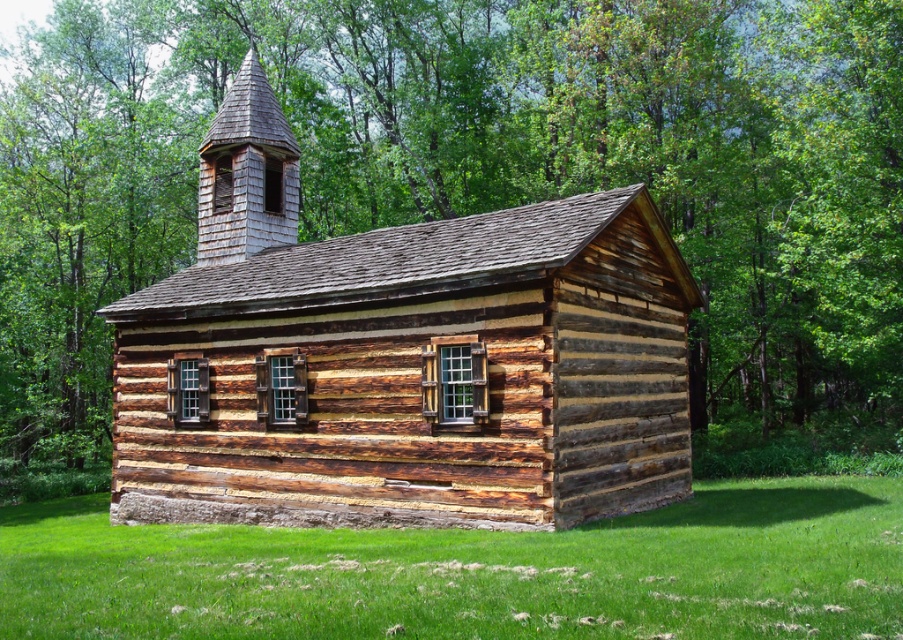
You are standing on the green grass at lower center and want to enter the weathered wood log cabin at center. Which direction should you walk to reach the cabin?

The weathered wood log cabin at center is located above green grass at lower center, so you should walk upward or towards the center to reach it.

You are standing in the forest near the weathered wood log cabin at center and the green grass at lower center. Which object is significantly taller?

The weathered wood log cabin at center is much taller than the green grass at lower center.

Based on the photo, you are standing in the forest and see the weathered wood log cabin at center. What are the coordinates of the cabin?

The coordinates of the weathered wood log cabin at center are at point (413, 376).